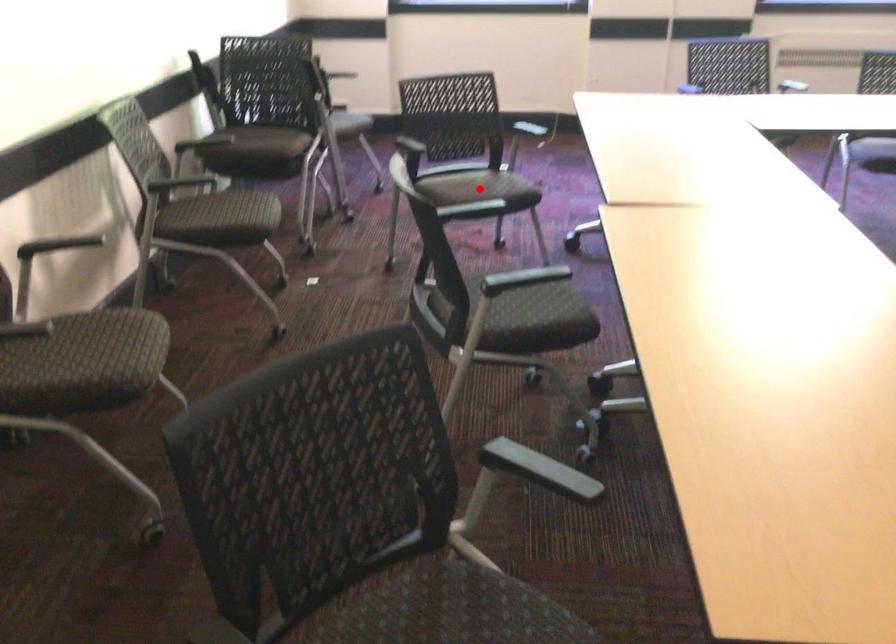
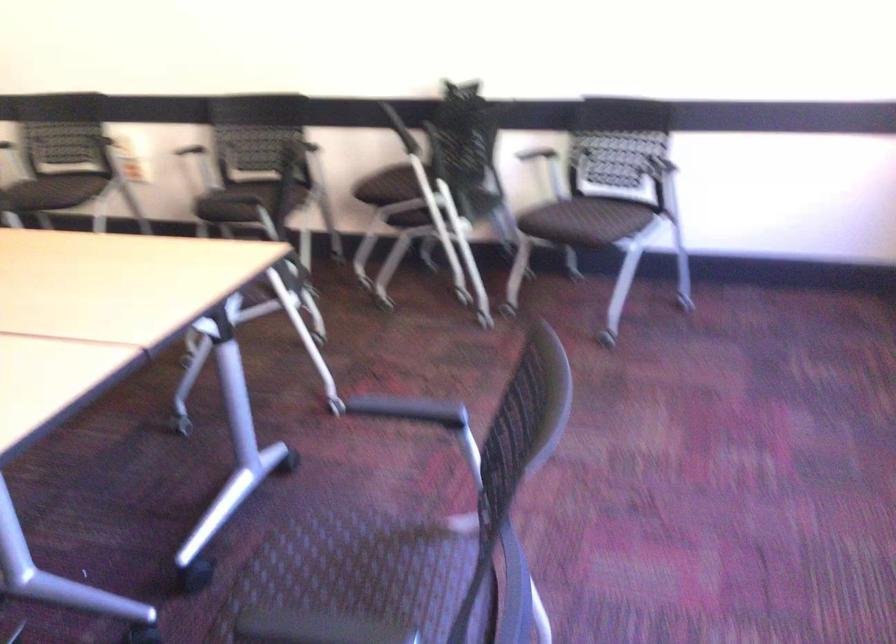
Question: I am providing you with two images of the same scene from different viewpoints. A red point is marked on the first image. At the location where the point appears in image 1, is it still visible in image 2?

Choices:
 (A) Yes
 (B) No

Answer: (B)